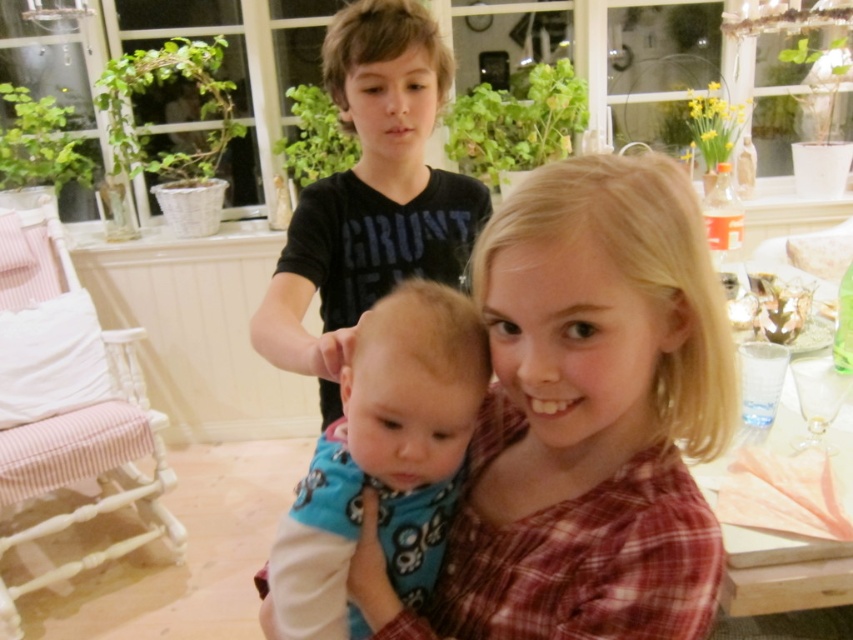
Question: Does plaid fabric shirt at center have a smaller size compared to blue fabric baby at center?

Choices:
 (A) yes
 (B) no

Answer: (B)

Question: Is plaid fabric shirt at center bigger than blue fabric baby at center?

Choices:
 (A) yes
 (B) no

Answer: (A)

Question: Which of the following is the farthest from the observer?

Choices:
 (A) plaid fabric shirt at center
 (B) blue fabric baby at center
 (C) black matte shirt at upper center

Answer: (C)

Question: Which object appears closest to the camera in this image?

Choices:
 (A) black matte shirt at upper center
 (B) blue fabric baby at center
 (C) plaid fabric shirt at center

Answer: (C)

Question: Is the position of plaid fabric shirt at center less distant than that of black matte shirt at upper center?

Choices:
 (A) yes
 (B) no

Answer: (A)

Question: Which point is closer to the camera taking this photo?

Choices:
 (A) (641, 548)
 (B) (280, 627)

Answer: (A)